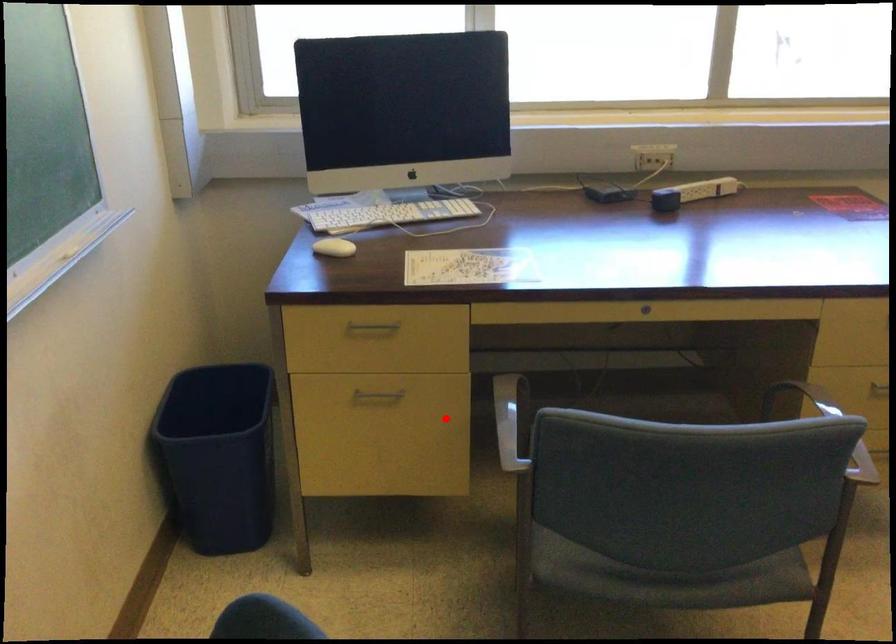
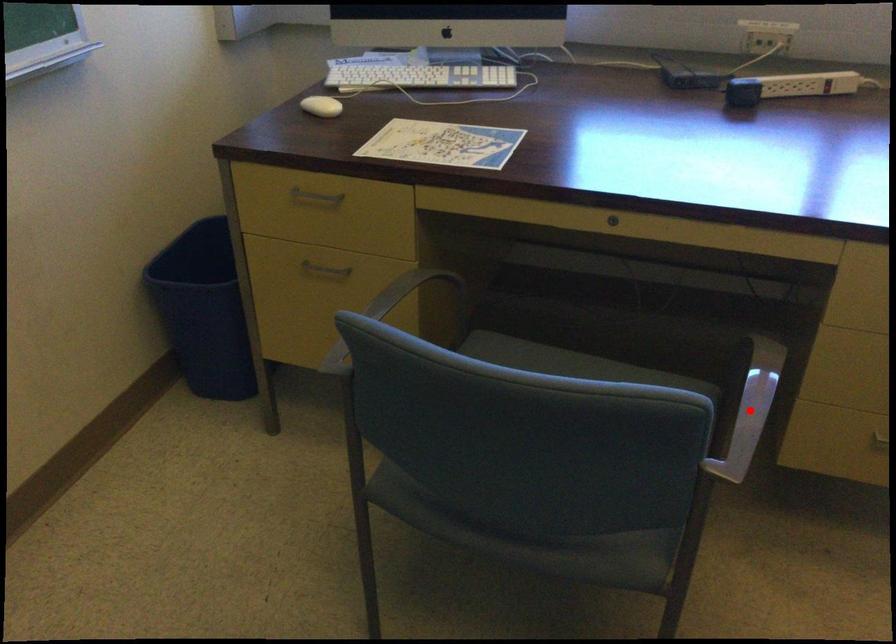
I am providing you with two images of the same scene from different viewpoints. A red point is marked on the first image and another point is marked on the second image. Is the marked point in image1 the same physical position as the marked point in image2?

No